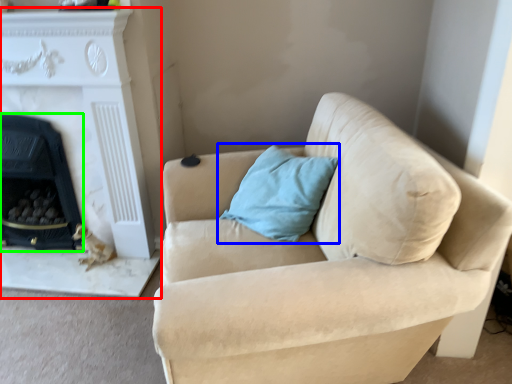
Question: Considering the real-world distances, which object is closest to fireplace (highlighted by a red box)? pillow (highlighted by a blue box) or fireplace (highlighted by a green box).

Choices:
 (A) pillow
 (B) fireplace

Answer: (B)